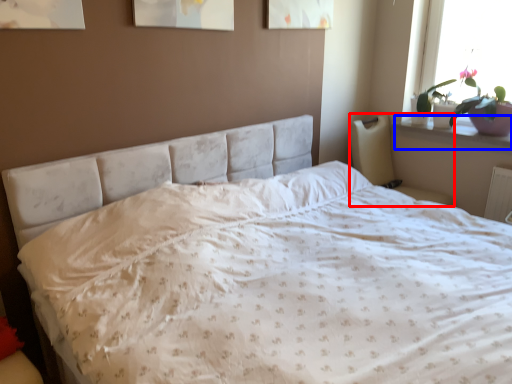
Question: Among these objects, which one is farthest to the camera, armchair (highlighted by a red box) or window sill (highlighted by a blue box)?

Choices:
 (A) armchair
 (B) window sill

Answer: (B)